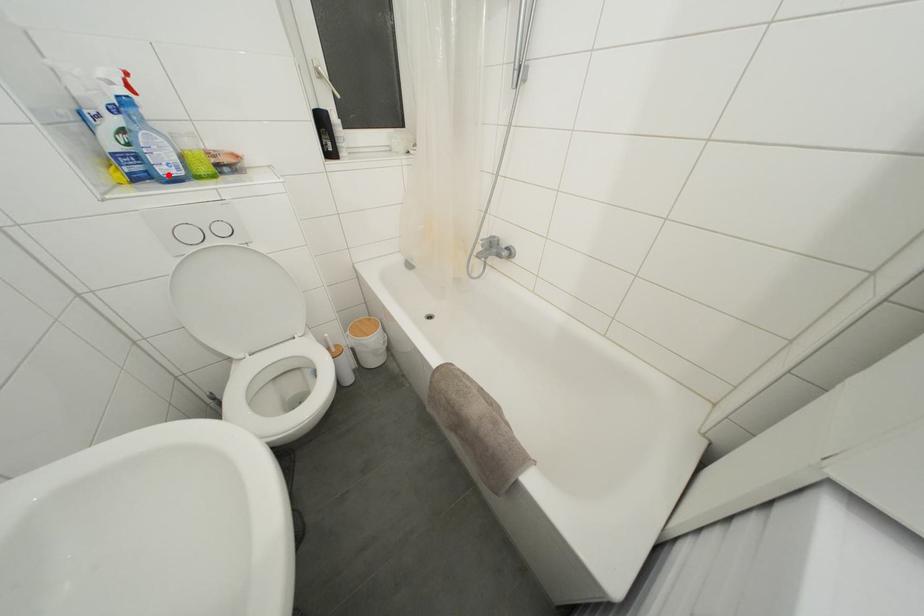
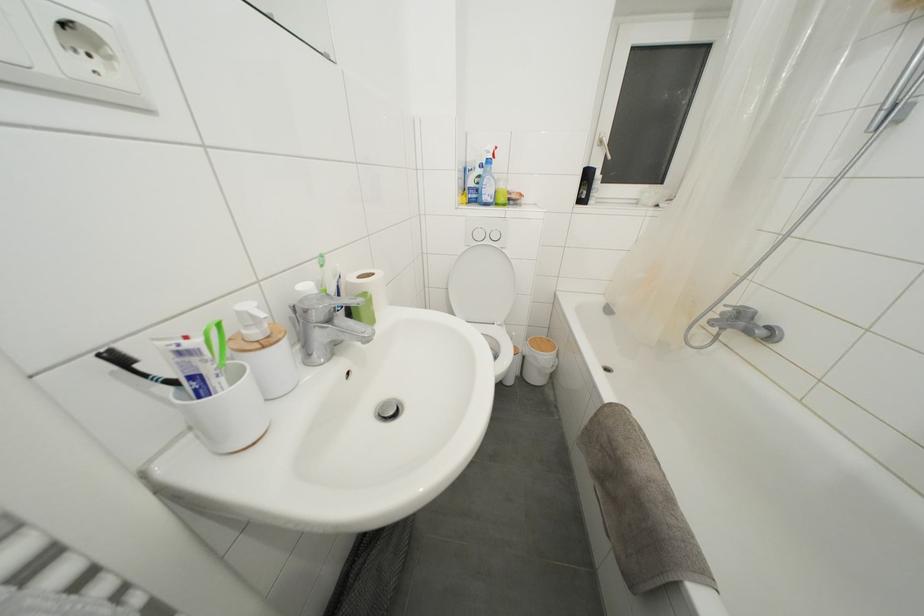
Question: A red point is marked in image1. In image2, is the corresponding 3D point closer to the camera or farther? Reply with the corresponding letter.

Choices:
 (A) The corresponding 3D point is closer.
 (B) The corresponding 3D point is farther.

Answer: (A)